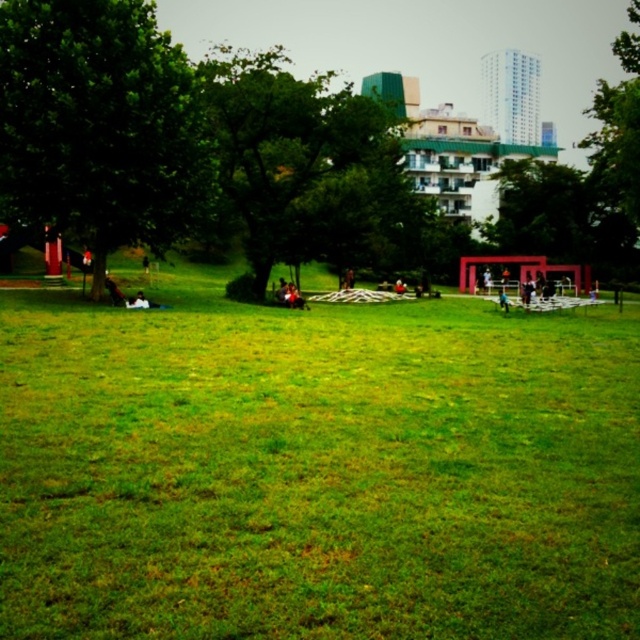
Who is positioned more to the left, green leafy tree at right or smooth black shirt at center?

Positioned to the left is smooth black shirt at center.

Which of these two, green leafy tree at right or smooth black shirt at center, stands taller?

green leafy tree at right is taller.

Which is in front, point (608, 156) or point (500, 296)?

Positioned in front is point (500, 296).

Where is `green leafy tree at right`? The image size is (640, 640). green leafy tree at right is located at coordinates (616, 157).

Does green leafy tree at center have a larger size compared to smooth black shirt at center?

Yes.

Based on the photo, is green leafy tree at center positioned behind smooth black shirt at center?

No, it is not.

I want to click on green leafy tree at center, so click(298, 160).

Based on the photo, who is shorter, green leafy tree at left or smooth black shirt at center?

smooth black shirt at center

Can you confirm if green leafy tree at left is positioned above smooth black shirt at center?

Indeed, green leafy tree at left is positioned over smooth black shirt at center.

The height and width of the screenshot is (640, 640). Identify the location of green leafy tree at left. (100, 124).